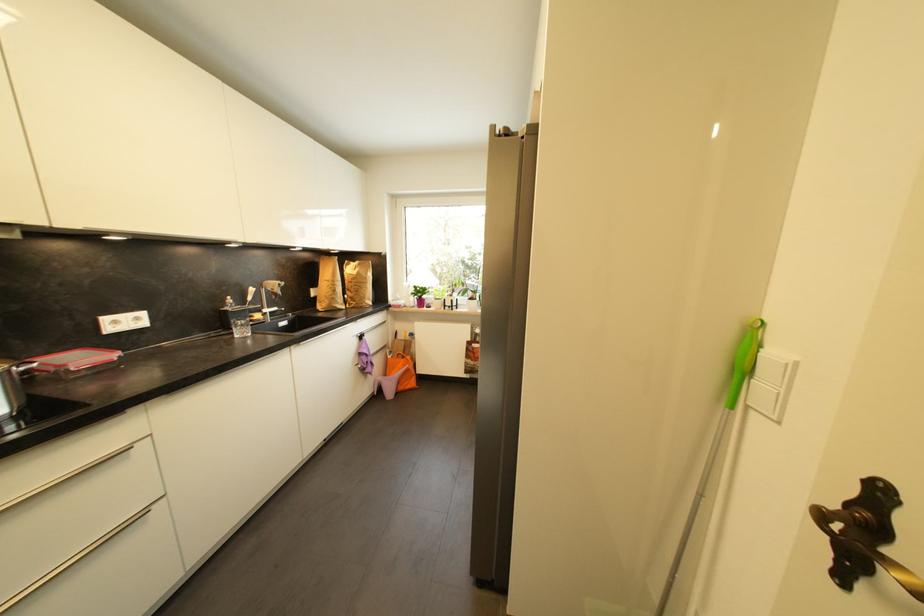
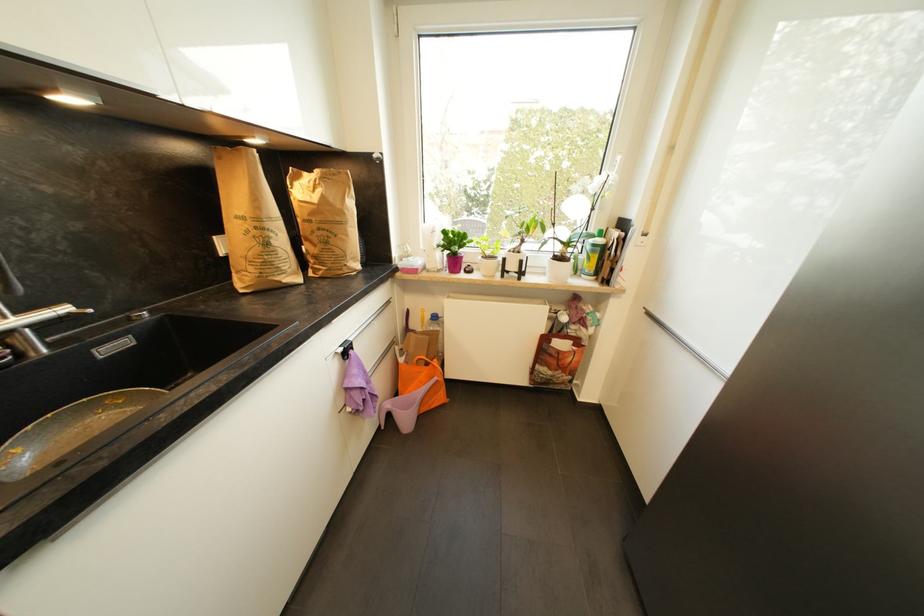
In the second image, find the point that corresponds to pixel 274 309 in the first image.

(27, 313)